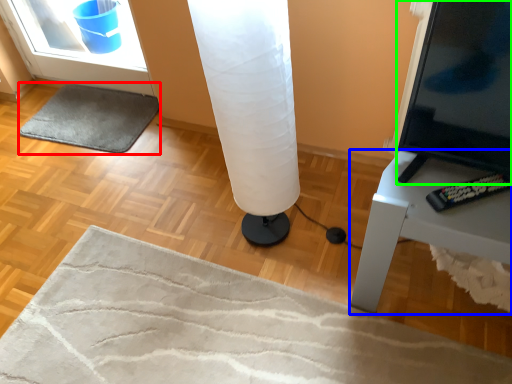
Question: Which is nearer to the yoga mat (highlighted by a red box)? furniture (highlighted by a blue box) or screen (highlighted by a green box).

Choices:
 (A) furniture
 (B) screen

Answer: (A)